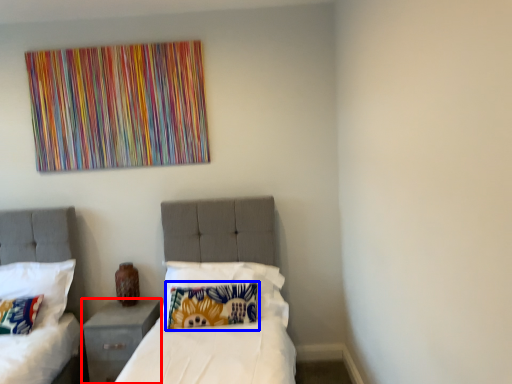
Question: Which object is closer to the camera taking this photo, nightstand (highlighted by a red box) or pillow (highlighted by a blue box)?

Choices:
 (A) nightstand
 (B) pillow

Answer: (B)